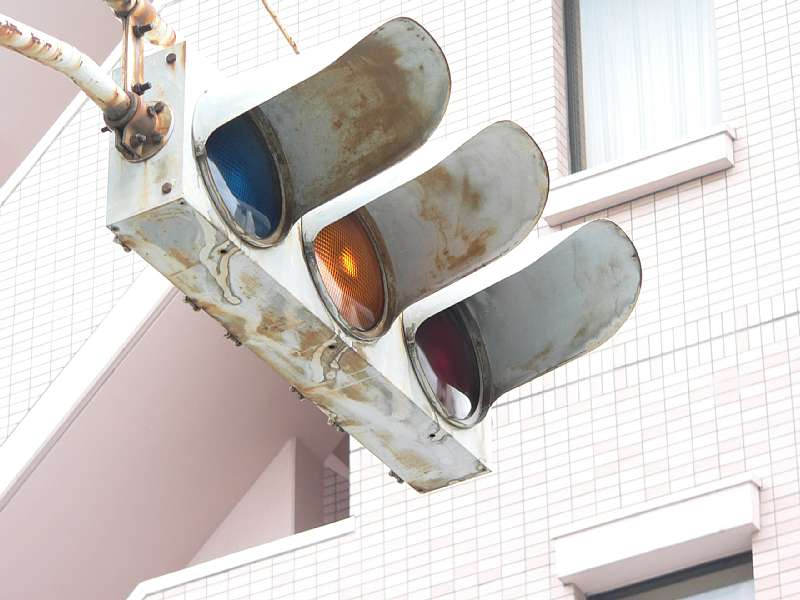
Find the location of `window`. window is located at coordinates (640, 90).